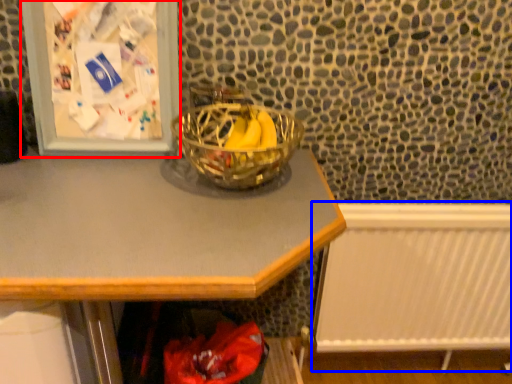
Question: Which object is further to the camera taking this photo, picture frame (highlighted by a red box) or radiator (highlighted by a blue box)?

Choices:
 (A) picture frame
 (B) radiator

Answer: (B)